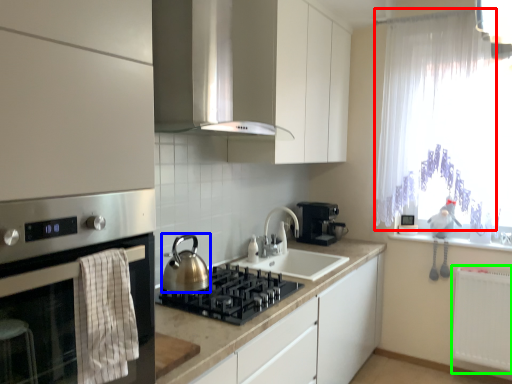
Question: Which object is positioned farthest from curtain (highlighted by a red box)? Select from kitchen appliance (highlighted by a blue box) and radiator (highlighted by a green box).

Choices:
 (A) kitchen appliance
 (B) radiator

Answer: (A)